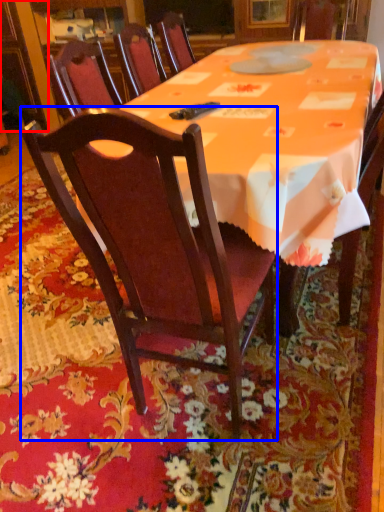
Question: Which point is closer to the camera, cabinetry (highlighted by a red box) or chair (highlighted by a blue box)?

Choices:
 (A) cabinetry
 (B) chair

Answer: (B)